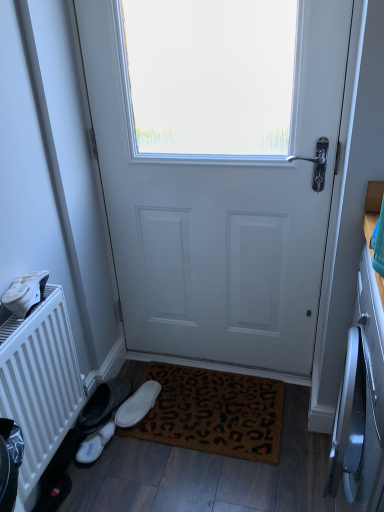
Question: Is white matte door at center oriented away from white suede slippers at lower left, arranged as the 2th footwear when viewed from the right?

Choices:
 (A) yes
 (B) no

Answer: (B)

Question: From a real-world perspective, is white matte door at center positioned under white suede slippers at lower left, arranged as the 2th footwear when viewed from the right, based on gravity?

Choices:
 (A) yes
 (B) no

Answer: (B)

Question: Can you confirm if white matte door at center is thinner than white suede slippers at lower left, the 1th footwear from the left?

Choices:
 (A) yes
 (B) no

Answer: (B)

Question: Is white matte door at center next to white suede slippers at lower left, the 1th footwear from the left, and touching it?

Choices:
 (A) no
 (B) yes

Answer: (A)

Question: Is white matte door at center to the right of white suede slippers at lower left, the 1th footwear from the left, from the viewer's perspective?

Choices:
 (A) no
 (B) yes

Answer: (B)

Question: Based on their positions, is white suede slippers at lower left, the 1th footwear from the left, located to the left or right of white suede slipper at lower left, marked as the second footwear in a left-to-right arrangement?

Choices:
 (A) left
 (B) right

Answer: (A)

Question: Considering their positions, is white suede slippers at lower left, arranged as the 2th footwear when viewed from the right, located in front of or behind white suede slipper at lower left, marked as the second footwear in a left-to-right arrangement?

Choices:
 (A) front
 (B) behind

Answer: (A)

Question: From the image's perspective, is white suede slippers at lower left, the 1th footwear from the left, above or below white suede slipper at lower left, marked as the second footwear in a left-to-right arrangement?

Choices:
 (A) below
 (B) above

Answer: (A)

Question: Is white suede slippers at lower left, the 1th footwear from the left, situated inside white suede slipper at lower left, marked as the second footwear in a left-to-right arrangement, or outside?

Choices:
 (A) outside
 (B) inside

Answer: (A)

Question: From the image's perspective, is brown coir doormat at lower center above or below white suede slipper at lower left, marked as the second footwear in a left-to-right arrangement?

Choices:
 (A) below
 (B) above

Answer: (A)

Question: Considering the positions of brown coir doormat at lower center and white suede slipper at lower left, the first footwear from the right, in the image, is brown coir doormat at lower center wider or thinner than white suede slipper at lower left, the first footwear from the right,?

Choices:
 (A) thin
 (B) wide

Answer: (B)

Question: Based on their positions, is brown coir doormat at lower center located to the left or right of white suede slipper at lower left, the first footwear from the right?

Choices:
 (A) left
 (B) right

Answer: (B)

Question: Is brown coir doormat at lower center situated inside white suede slipper at lower left, marked as the second footwear in a left-to-right arrangement, or outside?

Choices:
 (A) inside
 (B) outside

Answer: (B)

Question: From their relative heights in the image, would you say white matte door at center is taller or shorter than white suede slippers at lower left, the 1th footwear from the left?

Choices:
 (A) short
 (B) tall

Answer: (B)

Question: Which is correct: white matte door at center is inside white suede slippers at lower left, arranged as the 2th footwear when viewed from the right, or outside of it?

Choices:
 (A) inside
 (B) outside

Answer: (B)